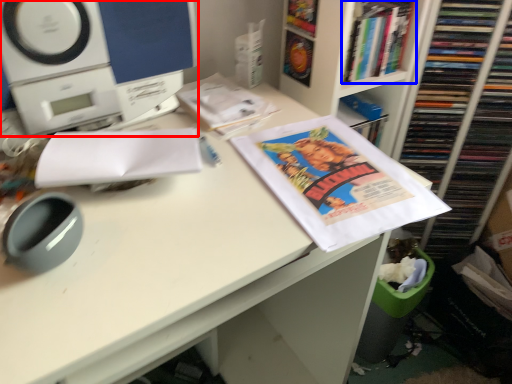
Question: Which object is further to the camera taking this photo, home appliance (highlighted by a red box) or book (highlighted by a blue box)?

Choices:
 (A) home appliance
 (B) book

Answer: (B)